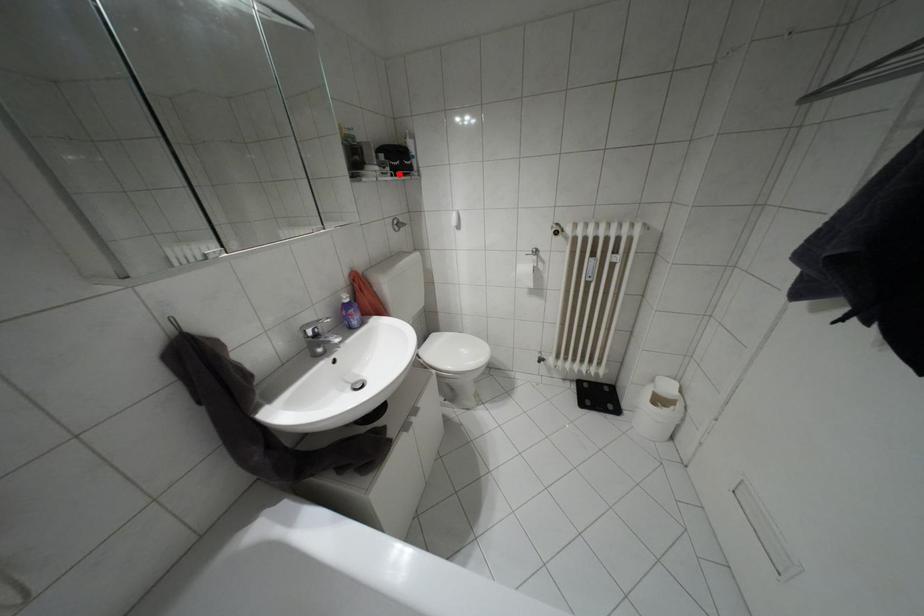
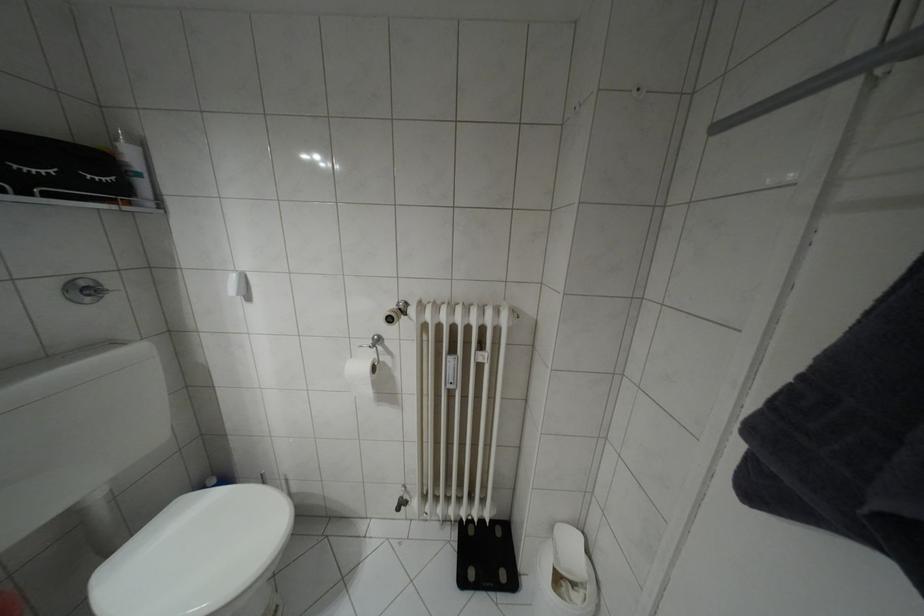
Where in the second image is the point corresponding to the highlighted location from the first image?

(49, 195)